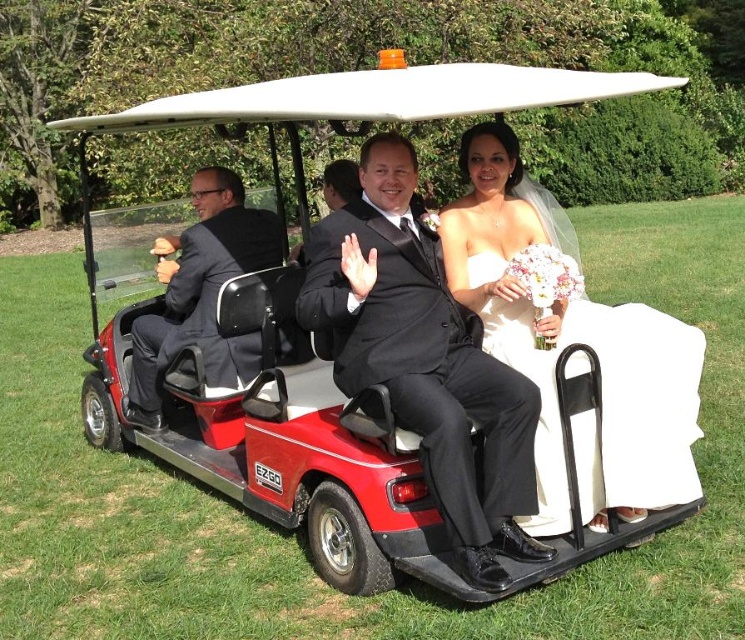
You are a photographer at the wedding and need to adjust the lighting to ensure both the white satin dress at center and the matte black suit at left are well lit. Given their positions, which object is closer to the sunlight source?

The white satin dress at center is positioned under the matte black suit at left, meaning it is lower in position. Since the sunlight is coming from above, the matte black suit at left may be closer to the light source, casting a shadow over the dress.